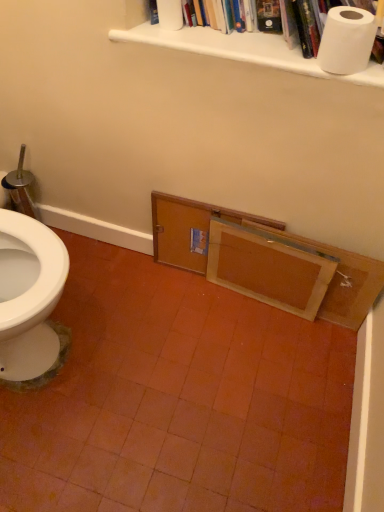
Measure the distance between white matte toilet paper at upper center, the second toilet paper positioned from the front, and camera.

A distance of 1.03 meters exists between white matte toilet paper at upper center, the second toilet paper positioned from the front, and camera.

The width and height of the screenshot is (384, 512). What are the coordinates of `wooden drawer at lower center, the 1th drawer positioned from the left` in the screenshot? It's located at (190, 229).

Where is `wooden drawer at center, the second drawer from the left`? This screenshot has height=512, width=384. wooden drawer at center, the second drawer from the left is located at coordinates (268, 268).

This screenshot has height=512, width=384. What do you see at coordinates (347, 40) in the screenshot?
I see `white matte toilet paper at upper right, which ranks as the 2th toilet paper in back-to-front order` at bounding box center [347, 40].

Locate an element on the screen. Image resolution: width=384 pixels, height=512 pixels. white matte toilet paper at upper right, the 2th toilet paper viewed from the top is located at coordinates (347, 40).

Find the location of `wooden cabinet at lower right`. wooden cabinet at lower right is located at coordinates (267, 261).

Locate an element on the screen. This screenshot has width=384, height=512. white matte toilet paper at upper center, which is counted as the 1th toilet paper, starting from the back is located at coordinates (170, 14).

Considering the relative positions of wooden drawer at lower center, which is counted as the 2th drawer, starting from the right, and white paper towel at upper center in the image provided, is wooden drawer at lower center, which is counted as the 2th drawer, starting from the right, to the left of white paper towel at upper center from the viewer's perspective?

Yes, wooden drawer at lower center, which is counted as the 2th drawer, starting from the right, is to the left of white paper towel at upper center.

Which is less distant, (182, 229) or (226, 42)?

Point (182, 229).

In the image, is wooden drawer at lower center, the 1th drawer positioned from the left, positioned in front of or behind white paper towel at upper center?

wooden drawer at lower center, the 1th drawer positioned from the left, is behind white paper towel at upper center.

Is white paper towel at upper center inside wooden drawer at lower center, which is counted as the 2th drawer, starting from the right?

No.

From a real-world perspective, who is located higher, wooden cabinet at lower right or wooden drawer at lower center, which is counted as the 2th drawer, starting from the right?

In real-world perspective, wooden drawer at lower center, which is counted as the 2th drawer, starting from the right, is above.

Can you confirm if wooden cabinet at lower right is smaller than wooden drawer at lower center, which is counted as the 2th drawer, starting from the right?

Yes, wooden cabinet at lower right is smaller than wooden drawer at lower center, which is counted as the 2th drawer, starting from the right.

From the image's perspective, is wooden cabinet at lower right located above or below wooden drawer at lower center, the 1th drawer positioned from the left?

wooden cabinet at lower right is situated lower than wooden drawer at lower center, the 1th drawer positioned from the left, in the image.

Considering the points (174, 6) and (183, 5), which point is behind, point (174, 6) or point (183, 5)?

Positioned behind is point (183, 5).

Is white matte toilet paper at upper center, which is counted as the 1th toilet paper, starting from the back, closer to camera compared to white paper towel at upper center?

No, the depth of white matte toilet paper at upper center, which is counted as the 1th toilet paper, starting from the back, is greater than that of white paper towel at upper center.

Can you tell me how much white matte toilet paper at upper center, the second toilet paper positioned from the front, and white paper towel at upper center differ in facing direction?

white matte toilet paper at upper center, the second toilet paper positioned from the front, and white paper towel at upper center are facing 0.00645 degrees away from each other.

From a real-world perspective, which object rests below the other?

In real-world perspective, white matte toilet paper at upper center, which is the first toilet paper from top to bottom, is lower.

From the image's perspective, is wooden drawer at lower center, which is counted as the 2th drawer, starting from the right, located above wooden drawer at center, the second drawer from the left?

Yes, from the image's perspective, wooden drawer at lower center, which is counted as the 2th drawer, starting from the right, is above wooden drawer at center, the second drawer from the left.

Which is more to the right, wooden drawer at lower center, which is counted as the 2th drawer, starting from the right, or wooden drawer at center, which is the 1th drawer from right to left?

Positioned to the right is wooden drawer at center, which is the 1th drawer from right to left.

In the image, is wooden drawer at lower center, which is counted as the 2th drawer, starting from the right, positioned in front of or behind wooden drawer at center, which is the 1th drawer from right to left?

Visually, wooden drawer at lower center, which is counted as the 2th drawer, starting from the right, is located behind wooden drawer at center, which is the 1th drawer from right to left.

Between wooden cabinet at lower right and white matte toilet paper at upper right, which ranks as the 2th toilet paper in back-to-front order, which one appears on the right side from the viewer's perspective?

Positioned to the right is white matte toilet paper at upper right, which ranks as the 2th toilet paper in back-to-front order.

From the image's perspective, is wooden cabinet at lower right located above white matte toilet paper at upper right, which ranks as the 2th toilet paper in back-to-front order?

No.

Between wooden cabinet at lower right and white matte toilet paper at upper right, the first toilet paper positioned from the front, which one has larger size?

Bigger between the two is wooden cabinet at lower right.

Could you tell me if wooden cabinet at lower right is turned towards white matte toilet paper at upper right, the 1th toilet paper in the right-to-left sequence?

No, wooden cabinet at lower right is not aimed at white matte toilet paper at upper right, the 1th toilet paper in the right-to-left sequence.

Starting from the white matte toilet paper at upper right, placed as the 2th toilet paper when sorted from left to right, which drawer is the 2nd one to the left? Please provide its 2D coordinates.

[(190, 229)]

Can you confirm if white matte toilet paper at upper right, placed as the 2th toilet paper when sorted from left to right, is smaller than wooden drawer at lower center, which is counted as the 2th drawer, starting from the right?

Yes.

From their relative heights in the image, would you say white matte toilet paper at upper right, the 1th toilet paper in the right-to-left sequence, is taller or shorter than wooden drawer at lower center, the 1th drawer positioned from the left?

In the image, white matte toilet paper at upper right, the 1th toilet paper in the right-to-left sequence, appears to be shorter than wooden drawer at lower center, the 1th drawer positioned from the left.

Consider the image. Which is more to the right, white matte toilet paper at upper right, which ranks as the 2th toilet paper in back-to-front order, or wooden drawer at lower center, the 1th drawer positioned from the left?

From the viewer's perspective, white matte toilet paper at upper right, which ranks as the 2th toilet paper in back-to-front order, appears more on the right side.

Does white matte toilet paper at upper center, the second toilet paper positioned from the front, come behind wooden drawer at center, the second drawer from the left?

No, white matte toilet paper at upper center, the second toilet paper positioned from the front, is closer to the viewer.

Does white matte toilet paper at upper center, which is counted as the 1th toilet paper, starting from the back, appear on the left side of wooden drawer at center, which is the 1th drawer from right to left?

Correct, you'll find white matte toilet paper at upper center, which is counted as the 1th toilet paper, starting from the back, to the left of wooden drawer at center, which is the 1th drawer from right to left.

From the picture: Is white matte toilet paper at upper center, which is the first toilet paper from top to bottom, aimed at wooden drawer at center, the second drawer from the left?

No, white matte toilet paper at upper center, which is the first toilet paper from top to bottom, is not facing towards wooden drawer at center, the second drawer from the left.

From the image's perspective, does white matte toilet paper at upper center, which is counted as the 1th toilet paper, starting from the back, appear higher than wooden drawer at center, which is the 1th drawer from right to left?

Yes, from the image's perspective, white matte toilet paper at upper center, which is counted as the 1th toilet paper, starting from the back, is above wooden drawer at center, which is the 1th drawer from right to left.

From the image's perspective, count 1st drawers downward from the white paper towel at upper center and point to it. Please provide its 2D coordinates.

[(190, 229)]

Locate an element on the screen. The image size is (384, 512). drawer above the wooden cabinet at lower right (from the image's perspective) is located at coordinates (190, 229).

Considering their positions, is white paper towel at upper center positioned closer to wooden drawer at lower center, which is counted as the 2th drawer, starting from the right, than white matte toilet paper at upper center, the second toilet paper positioned from the front?

white paper towel at upper center is closer to wooden drawer at lower center, which is counted as the 2th drawer, starting from the right.

Which object lies nearer to the anchor point white matte toilet paper at upper right, the 2th toilet paper viewed from the top, white paper towel at upper center or wooden cabinet at lower right?

Among the two, white paper towel at upper center is located nearer to white matte toilet paper at upper right, the 2th toilet paper viewed from the top.

From the image, which object appears to be farther from white matte toilet paper at upper center, which is the 2th toilet paper in right-to-left order, wooden drawer at lower center, the 1th drawer positioned from the left, or white matte toilet paper at upper right, placed as the 2th toilet paper when sorted from left to right?

wooden drawer at lower center, the 1th drawer positioned from the left, is positioned further to the anchor white matte toilet paper at upper center, which is the 2th toilet paper in right-to-left order.

From the image, which object appears to be nearer to white paper towel at upper center, wooden drawer at lower center, which is counted as the 2th drawer, starting from the right, or white matte toilet paper at upper center, which is the first toilet paper from top to bottom?

Among the two, white matte toilet paper at upper center, which is the first toilet paper from top to bottom, is located nearer to white paper towel at upper center.

Based on their spatial positions, is wooden cabinet at lower right or wooden drawer at lower center, which is counted as the 2th drawer, starting from the right, further from white matte toilet paper at upper right, the 2th toilet paper viewed from the top?

wooden drawer at lower center, which is counted as the 2th drawer, starting from the right.

Based on their spatial positions, is white matte toilet paper at upper right, the 2th toilet paper viewed from the top, or wooden drawer at center, which is the 1th drawer from right to left, closer to white paper towel at upper center?

white matte toilet paper at upper right, the 2th toilet paper viewed from the top, lies closer to white paper towel at upper center than the other object.

From the image, which object appears to be nearer to wooden cabinet at lower right, wooden drawer at lower center, which is counted as the 2th drawer, starting from the right, or wooden drawer at center, the second drawer from the left?

wooden drawer at center, the second drawer from the left.

Estimate the real-world distances between objects in this image. Which object is further from white paper towel at upper center, white matte toilet paper at upper right, the 1th toilet paper in the right-to-left sequence, or wooden cabinet at lower right?

wooden cabinet at lower right lies further to white paper towel at upper center than the other object.

At what (x,y) coordinates should I click in order to perform the action: click on drawer that lies between white matte toilet paper at upper center, which is the 2th toilet paper in right-to-left order, and wooden drawer at center, the second drawer from the left, from top to bottom. Please return your answer as a coordinate pair (x, y). This screenshot has width=384, height=512. Looking at the image, I should click on (190, 229).

Find the location of `drawer that lies between white matte toilet paper at upper center, which appears as the 1th toilet paper when viewed from the left, and wooden cabinet at lower right from top to bottom`. drawer that lies between white matte toilet paper at upper center, which appears as the 1th toilet paper when viewed from the left, and wooden cabinet at lower right from top to bottom is located at coordinates (190, 229).

Where is `book between white matte toilet paper at upper center, which is the first toilet paper from top to bottom, and white matte toilet paper at upper right, the first toilet paper positioned from the front, from left to right`? The image size is (384, 512). book between white matte toilet paper at upper center, which is the first toilet paper from top to bottom, and white matte toilet paper at upper right, the first toilet paper positioned from the front, from left to right is located at coordinates (239, 44).

Locate an element on the screen. This screenshot has width=384, height=512. drawer situated between wooden cabinet at lower right and wooden drawer at center, the second drawer from the left, from left to right is located at coordinates (190, 229).